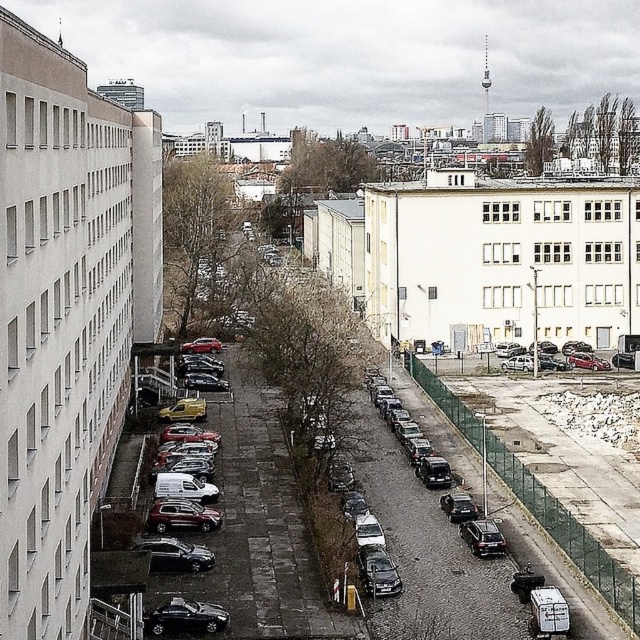
Is shiny silver sedan at center-left to the left of shiny black sedan at center-right from the viewer's perspective?

Indeed, shiny silver sedan at center-left is positioned on the left side of shiny black sedan at center-right.

Where is `shiny silver sedan at center-left`? shiny silver sedan at center-left is located at coordinates (176, 554).

Based on the photo, who is more distant from viewer, (208,557) or (493,528)?

Positioned behind is point (493,528).

You are a GUI agent. You are given a task and a screenshot of the screen. Output one action in this format:
    pyautogui.click(x=<x>, y=<y>)
    Task: Click on the shiny silver sedan at center-left
    
    Given the screenshot: What is the action you would take?
    pyautogui.click(x=176, y=554)

Based on the photo, can you confirm if shiny black car at lower center is wider than maroon metallic hatchback at lower left?

Yes, shiny black car at lower center is wider than maroon metallic hatchback at lower left.

Who is more distant from viewer, (195, 611) or (195, 525)?

Positioned behind is point (195, 525).

Who is more distant from viewer, (211, 605) or (186, 516)?

The point (186, 516) is behind.

You are a GUI agent. You are given a task and a screenshot of the screen. Output one action in this format:
    pyautogui.click(x=<x>, y=<y>)
    Task: Click on the shiny black car at lower center
    The height and width of the screenshot is (640, 640).
    Given the screenshot: What is the action you would take?
    pyautogui.click(x=186, y=618)

Does shiny black car at lower center come behind shiny black sedan at center-right?

No, shiny black car at lower center is closer to the viewer.

Is point (221, 625) less distant than point (483, 522)?

That is True.

Does point (176, 605) come closer to viewer compared to point (493, 548)?

Yes, point (176, 605) is in front of point (493, 548).

At what (x,y) coordinates should I click in order to perform the action: click on shiny black car at lower center. Please return your answer as a coordinate pair (x, y). Image resolution: width=640 pixels, height=640 pixels. Looking at the image, I should click on 186,618.